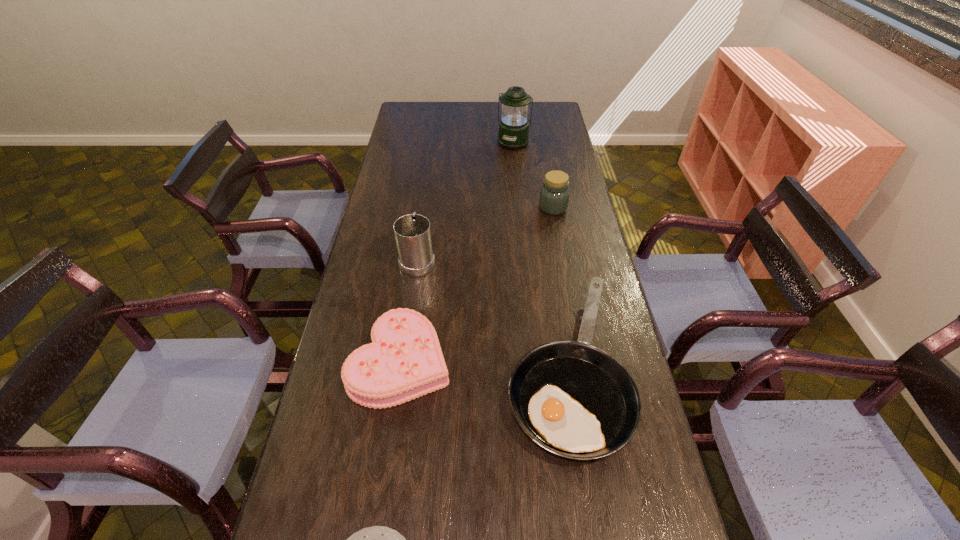
Locate an element on the screen. the farthest object is located at coordinates (513, 134).

The width and height of the screenshot is (960, 540). What are the coordinates of `lantern` in the screenshot? It's located at (513, 134).

At what (x,y) coordinates should I click in order to perform the action: click on the second tallest object. Please return your answer as a coordinate pair (x, y). The width and height of the screenshot is (960, 540). Looking at the image, I should click on (412, 232).

Where is `the fourth nearest object`? The image size is (960, 540). the fourth nearest object is located at coordinates (412, 232).

In order to click on the second farthest object in this screenshot , I will do `click(554, 197)`.

The width and height of the screenshot is (960, 540). In order to click on the third tallest object in this screenshot , I will do `click(554, 197)`.

Identify the location of cake. This screenshot has height=540, width=960. (404, 361).

Identify the location of frying pan. This screenshot has width=960, height=540. (575, 400).

Locate an element on the screen. vacant space located 0.310m on the back of the lantern is located at coordinates (510, 105).

The width and height of the screenshot is (960, 540). Identify the location of free space located 0.130m on the side of the mug with the handle. (423, 219).